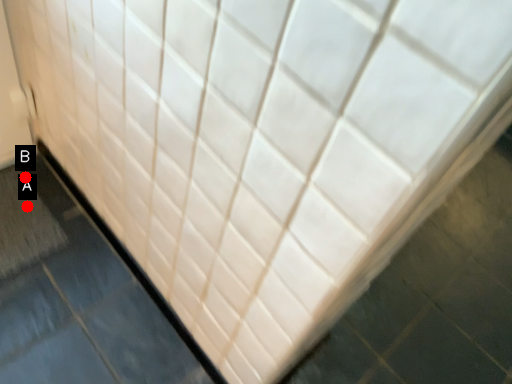
Question: Two points are circled on the image, labeled by A and B beside each circle. Which point appears closest to the camera in this image?

Choices:
 (A) A is closer
 (B) B is closer

Answer: (A)